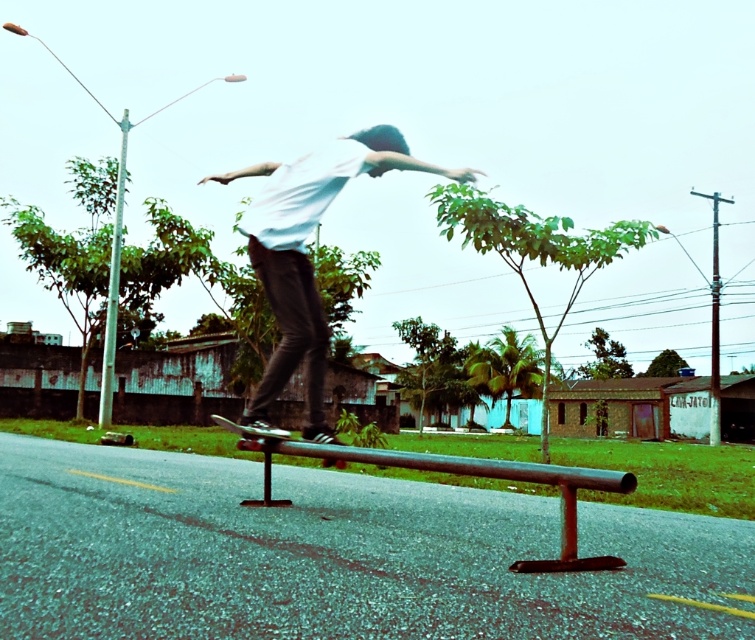
Question: Which of the following is the closest to the observer?

Choices:
 (A) metallic silver skateboard at center
 (B) white matte skateboarder at center
 (C) rusty metal rail at center

Answer: (C)

Question: Which point is closer to the camera?

Choices:
 (A) (256, 449)
 (B) (273, 212)
 (C) (245, 426)

Answer: (B)

Question: Does rusty metal rail at center have a larger size compared to metallic silver skateboard at center?

Choices:
 (A) yes
 (B) no

Answer: (B)

Question: Which object is positioned closest to the rusty metal rail at center?

Choices:
 (A) metallic silver skateboard at center
 (B) white matte skateboarder at center

Answer: (A)

Question: Does white matte skateboarder at center have a smaller size compared to rusty metal rail at center?

Choices:
 (A) no
 (B) yes

Answer: (A)

Question: Observing the image, what is the correct spatial positioning of rusty metal rail at center in reference to metallic silver skateboard at center?

Choices:
 (A) left
 (B) right

Answer: (B)